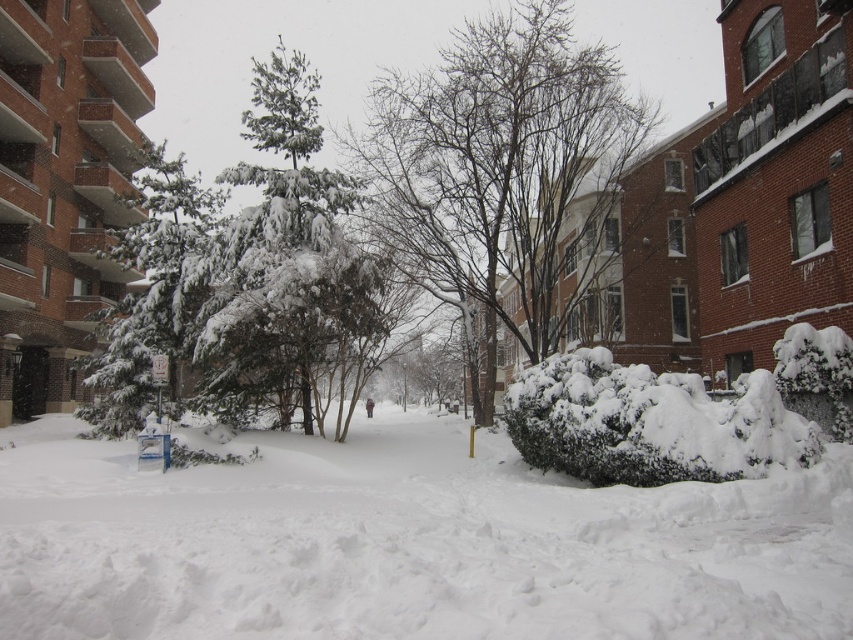
Based on the photo, who is positioned more to the right, snow-covered bare tree at center or snow-covered evergreen at left?

From the viewer's perspective, snow-covered bare tree at center appears more on the right side.

Image resolution: width=853 pixels, height=640 pixels. I want to click on snow-covered bare tree at center, so click(x=498, y=170).

I want to click on snow-covered bare tree at center, so click(x=498, y=170).

Between green textured pine tree at center and snow-covered evergreen at left, which one is positioned lower?

Positioned lower is snow-covered evergreen at left.

Who is more forward, (252, 92) or (148, 227)?

Positioned in front is point (148, 227).

I want to click on green textured pine tree at center, so click(288, 250).

Does snow-covered bare tree at center have a larger size compared to green textured pine tree at center?

Indeed, snow-covered bare tree at center has a larger size compared to green textured pine tree at center.

The image size is (853, 640). What are the coordinates of `snow-covered bare tree at center` in the screenshot? It's located at (498, 170).